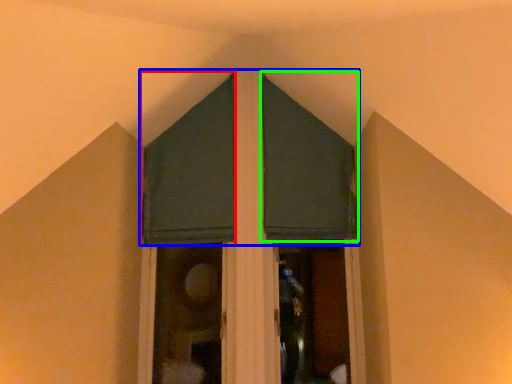
Question: Estimate the real-world distances between objects in this image. Which object is closer to curtain (highlighted by a red box), curtain (highlighted by a blue box) or curtain (highlighted by a green box)?

Choices:
 (A) curtain
 (B) curtain

Answer: (A)